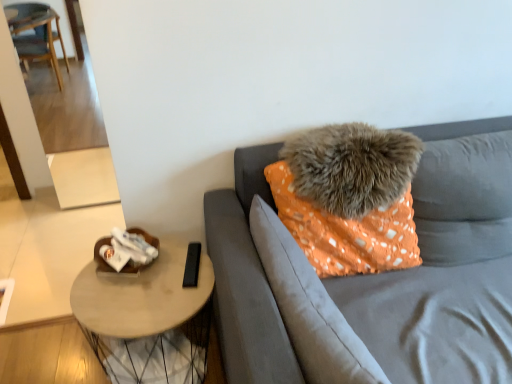
Question: Is orange fabric pillow at center, the second pillow in the top-to-bottom sequence, positioned beyond the bounds of orange fabric pillow at upper right?

Choices:
 (A) yes
 (B) no

Answer: (B)

Question: From the image's perspective, is orange fabric pillow at center, the 1th pillow ordered from the bottom, under orange fabric pillow at upper right?

Choices:
 (A) yes
 (B) no

Answer: (A)

Question: From the image's perspective, is orange fabric pillow at center, the 1th pillow ordered from the bottom, over orange fabric pillow at upper right?

Choices:
 (A) no
 (B) yes

Answer: (A)

Question: Would you say orange fabric pillow at center, the 1th pillow ordered from the bottom, contains orange fabric pillow at upper right?

Choices:
 (A) yes
 (B) no

Answer: (B)

Question: Does orange fabric pillow at center, the second pillow in the top-to-bottom sequence, have a greater width compared to orange fabric pillow at upper right?

Choices:
 (A) yes
 (B) no

Answer: (B)

Question: Considering the positions of point (455, 382) and point (249, 213), is point (455, 382) closer or farther from the camera than point (249, 213)?

Choices:
 (A) farther
 (B) closer

Answer: (B)

Question: From the image's perspective, relative to orange fabric pillow at center, the second pillow in the top-to-bottom sequence, is orange fabric pillow at upper right above or below?

Choices:
 (A) above
 (B) below

Answer: (A)

Question: In terms of height, does orange fabric pillow at upper right look taller or shorter compared to orange fabric pillow at center, the 1th pillow ordered from the bottom?

Choices:
 (A) tall
 (B) short

Answer: (A)

Question: From a real-world perspective, is orange fabric pillow at upper right physically located above or below orange fabric pillow at center, the second pillow in the top-to-bottom sequence?

Choices:
 (A) below
 (B) above

Answer: (A)

Question: Is orange fabric pillow at upper right inside the boundaries of light brown wooden table at lower left, or outside?

Choices:
 (A) outside
 (B) inside

Answer: (A)

Question: In terms of height, does orange fabric pillow at upper right look taller or shorter compared to light brown wooden table at lower left?

Choices:
 (A) tall
 (B) short

Answer: (A)

Question: Does point (394, 306) appear closer or farther from the camera than point (155, 299)?

Choices:
 (A) closer
 (B) farther

Answer: (B)

Question: Based on their sizes in the image, would you say orange fabric pillow at upper right is bigger or smaller than light brown wooden table at lower left?

Choices:
 (A) small
 (B) big

Answer: (B)

Question: In the image, is orange fabric pillow at center, the 1th pillow ordered from the bottom, positioned in front of or behind orange fabric pillow at upper right?

Choices:
 (A) behind
 (B) front

Answer: (A)

Question: In terms of size, does orange fabric pillow at center, the 1th pillow ordered from the bottom, appear bigger or smaller than orange fabric pillow at upper right?

Choices:
 (A) small
 (B) big

Answer: (A)